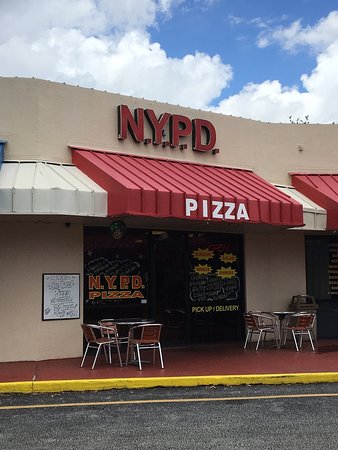
Find the location of a particular element. The height and width of the screenshot is (450, 338). trashcan is located at coordinates (315, 307).